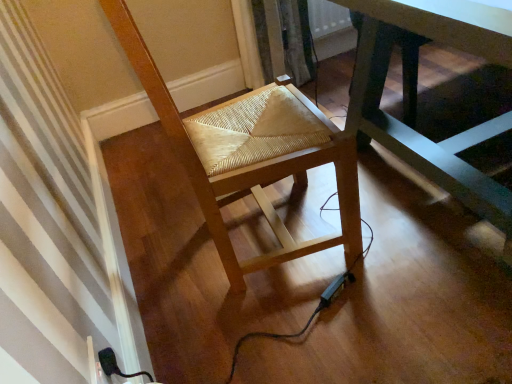
Question: Considering the relative positions of natural wood woven seat at center and dark green wooden table at center in the image provided, is natural wood woven seat at center to the left or to the right of dark green wooden table at center?

Choices:
 (A) right
 (B) left

Answer: (B)

Question: Based on their sizes in the image, would you say natural wood woven seat at center is bigger or smaller than dark green wooden table at center?

Choices:
 (A) big
 (B) small

Answer: (B)

Question: Considering the positions of point (309, 127) and point (438, 31), is point (309, 127) closer or farther from the camera than point (438, 31)?

Choices:
 (A) farther
 (B) closer

Answer: (A)

Question: Is dark green wooden table at center inside the boundaries of natural wood woven seat at center, or outside?

Choices:
 (A) inside
 (B) outside

Answer: (B)

Question: From a real-world perspective, is dark green wooden table at center positioned above or below natural wood woven seat at center?

Choices:
 (A) below
 (B) above

Answer: (A)

Question: Visually, is dark green wooden table at center positioned to the left or to the right of natural wood woven seat at center?

Choices:
 (A) right
 (B) left

Answer: (A)

Question: From the image's perspective, relative to natural wood woven seat at center, is dark green wooden table at center above or below?

Choices:
 (A) above
 (B) below

Answer: (A)